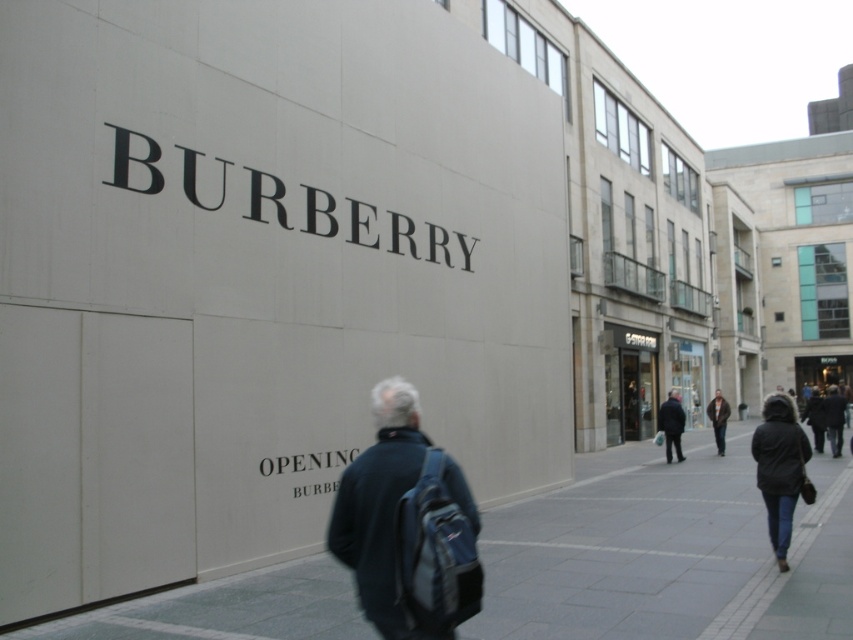
Question: Which object is positioned farthest from the dark blue jacket at center?

Choices:
 (A) dark brown leather jacket at center
 (B) dark blue backpack at center
 (C) gray concrete pavement at lower center

Answer: (B)

Question: Is dark blue backpack at center positioned at the back of dark blue jacket at center?

Choices:
 (A) no
 (B) yes

Answer: (A)

Question: Which point appears farthest from the camera in this image?

Choices:
 (A) (674, 419)
 (B) (405, 465)
 (C) (717, 406)
 (D) (807, 586)

Answer: (C)

Question: Is dark blue backpack at center closer to camera compared to dark blue jacket at center?

Choices:
 (A) no
 (B) yes

Answer: (B)

Question: Is gray concrete pavement at lower center thinner than dark blue jacket at center?

Choices:
 (A) yes
 (B) no

Answer: (B)

Question: Which object is closer to the camera taking this photo?

Choices:
 (A) dark brown leather jacket at center
 (B) dark blue backpack at center

Answer: (B)